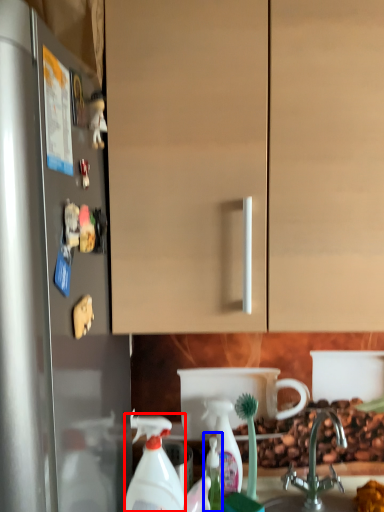
Question: Which point is closer to the camera, cleaning product (highlighted by a red box) or bottle (highlighted by a blue box)?

Choices:
 (A) cleaning product
 (B) bottle

Answer: (A)